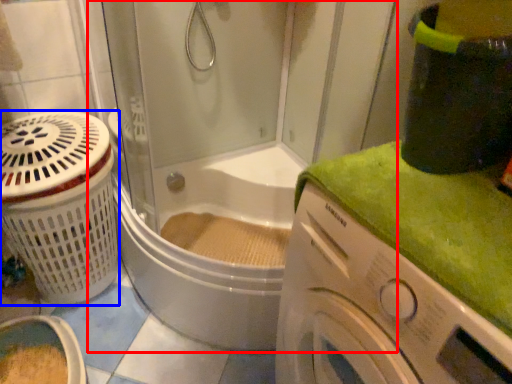
Question: Which object appears closest to the camera in this image, shower door (highlighted by a red box) or basket (highlighted by a blue box)?

Choices:
 (A) shower door
 (B) basket

Answer: (A)